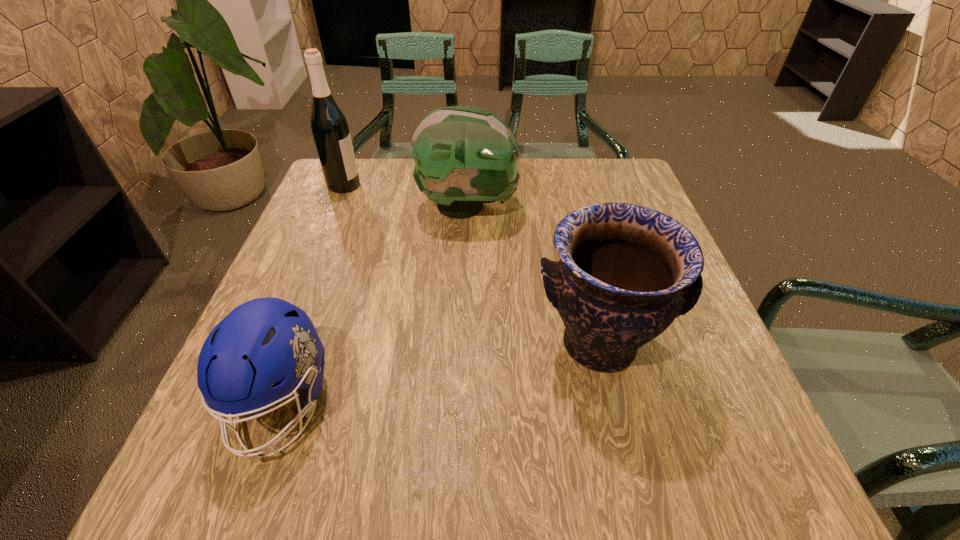
Where is `vacant space in between the tallest object and the taller football helmet`? The width and height of the screenshot is (960, 540). vacant space in between the tallest object and the taller football helmet is located at coordinates (406, 195).

I want to click on blank region between the shortest object and the farther football helmet, so click(x=374, y=305).

Choose which object is the third nearest neighbor to the nearer football helmet. Please provide its 2D coordinates. Your answer should be formatted as a tuple, i.e. [(x, y)], where the tuple contains the x and y coordinates of a point satisfying the conditions above.

[(330, 130)]

The height and width of the screenshot is (540, 960). In order to click on object that is the second nearest to the nearer football helmet in this screenshot , I will do pos(464,156).

The width and height of the screenshot is (960, 540). What are the coordinates of `free region that satisfies the following two spatial constraints: 1. on the visor of the taller football helmet; 2. on the face guard of the shorter football helmet` in the screenshot? It's located at [x=461, y=404].

This screenshot has height=540, width=960. I want to click on free location that satisfies the following two spatial constraints: 1. on the visor of the farther football helmet; 2. on the face guard of the left football helmet, so click(461, 404).

Identify the location of free spot that satisfies the following two spatial constraints: 1. on the visor of the farther football helmet; 2. on the face guard of the shorter football helmet. (461, 404).